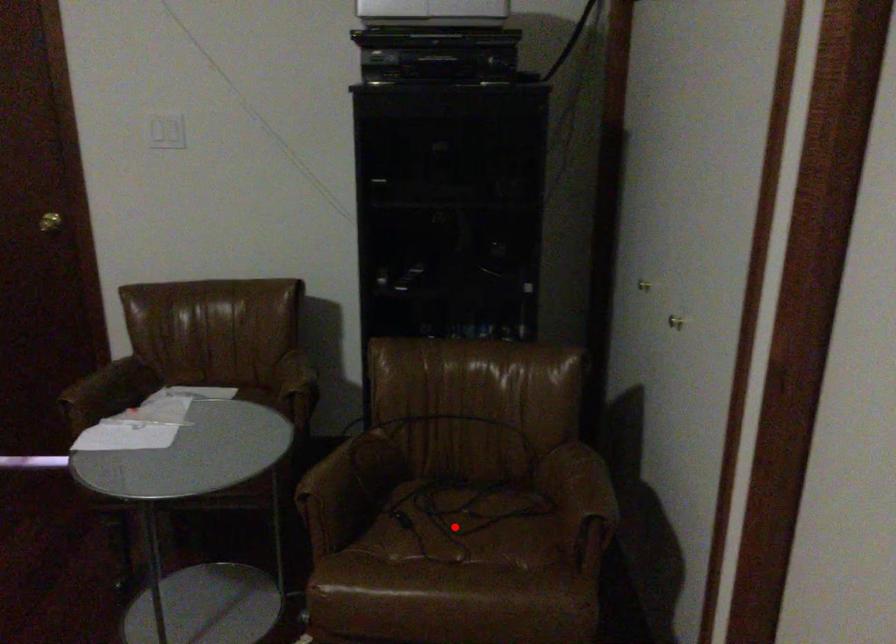
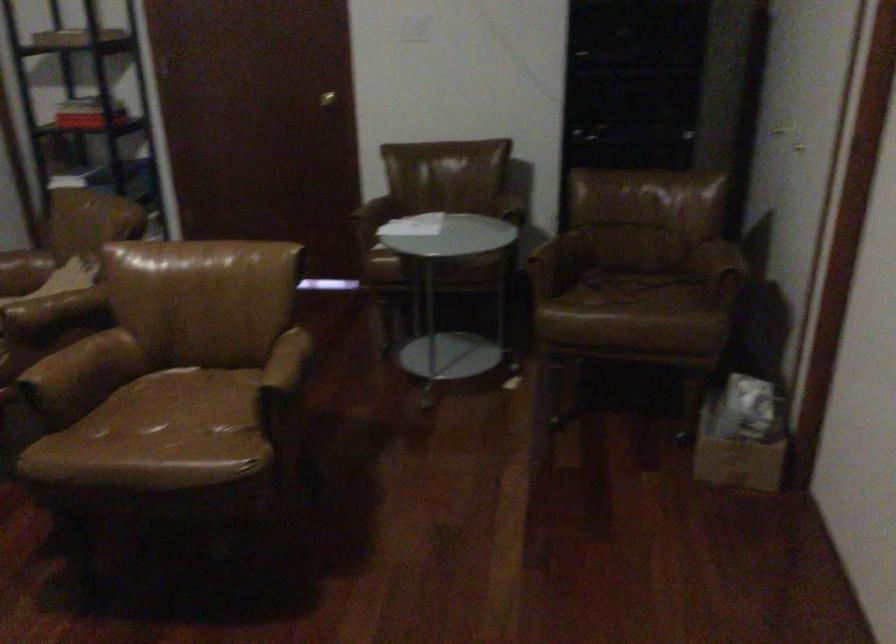
Question: I am providing you with two images of the same scene from different viewpoints. A red point is marked on the first image. Is the red point's position out of view in image 2?

Choices:
 (A) Yes
 (B) No

Answer: (B)